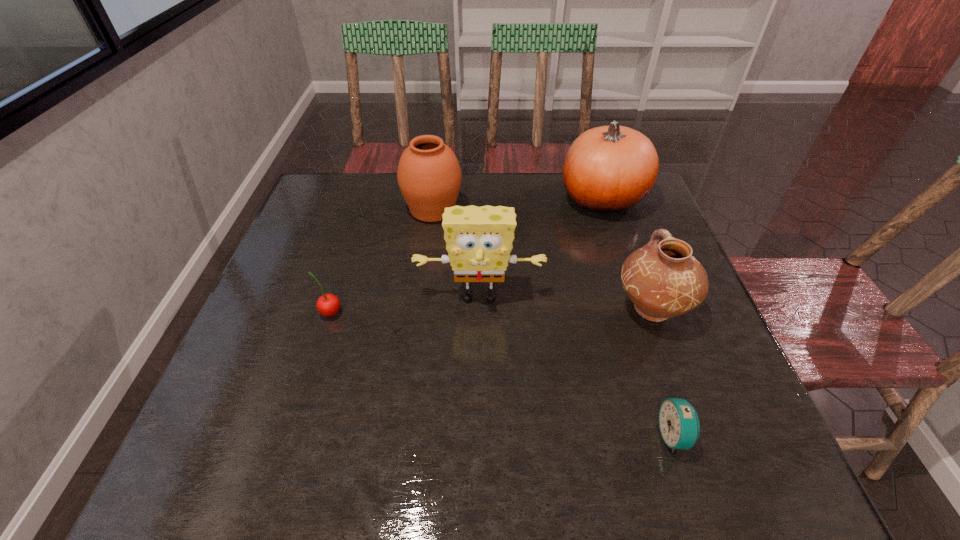
What are the coordinates of `free space located on the side of the pottery with the handle` in the screenshot? It's located at tap(625, 236).

Where is `vacant region located on the side of the pottery with the handle`? vacant region located on the side of the pottery with the handle is located at coordinates (627, 241).

Find the location of a particular element. vacant region located 0.260m on the side of the pottery with the handle is located at coordinates (617, 215).

The width and height of the screenshot is (960, 540). I want to click on vacant area located on the back of the cherry, so click(344, 271).

Locate an element on the screen. free spot located 0.230m on the front-facing side of the alarm clock is located at coordinates (532, 435).

In order to click on free region located 0.390m on the front-facing side of the alarm clock in this screenshot , I will do `click(443, 435)`.

Identify the location of vacant space located on the front-facing side of the alarm clock. (576, 435).

This screenshot has height=540, width=960. Find the location of `pumpkin at the far edge`. pumpkin at the far edge is located at coordinates (607, 169).

This screenshot has width=960, height=540. I want to click on urn that is positioned at the far edge, so click(x=429, y=176).

Locate an element on the screen. object positioned at the near edge is located at coordinates (679, 424).